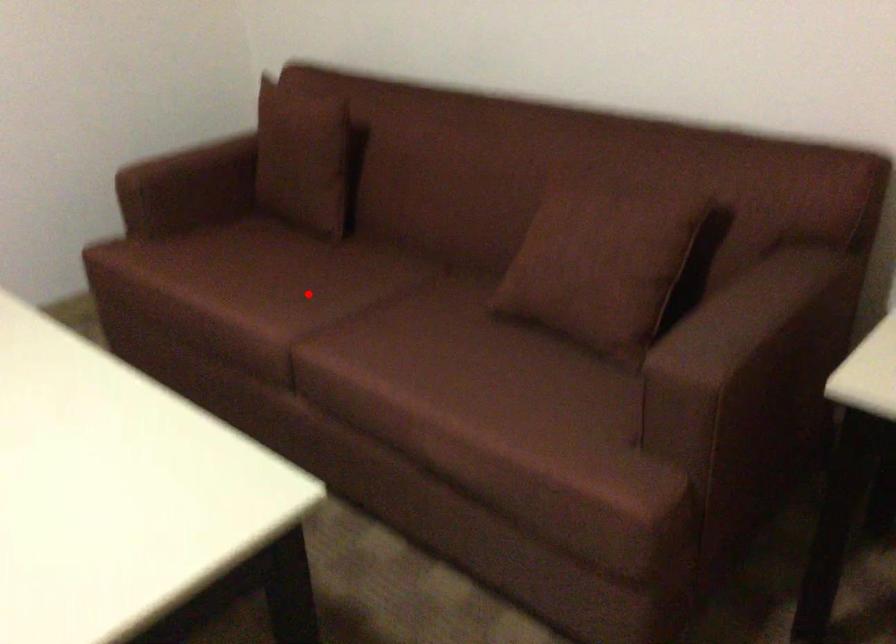
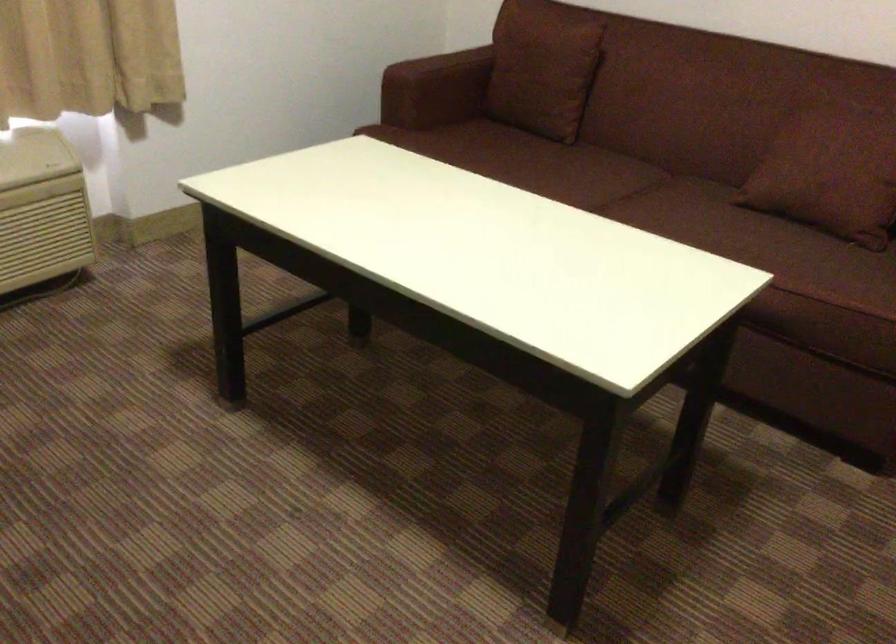
Question: I am providing you with two images of the same scene from different viewpoints. A red point is shown in image1. For the corresponding object point in image2, is it positioned nearer or farther from the camera?

Choices:
 (A) Nearer
 (B) Farther

Answer: (B)